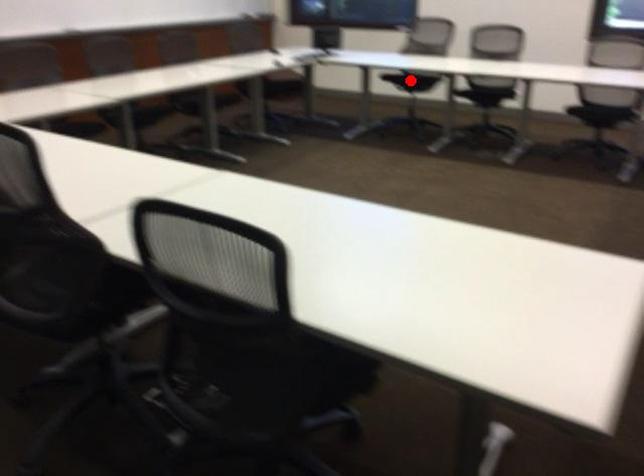
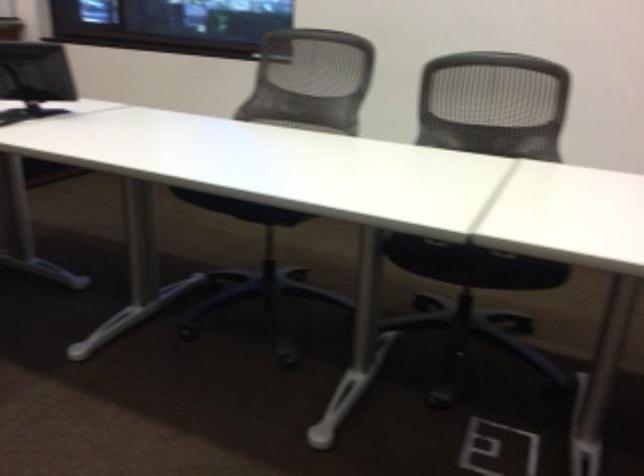
Question: I am providing you with two images of the same scene from different viewpoints. A red point is marked on the first image. At the location where the point appears in image 1, is it still visible in image 2?

Choices:
 (A) Yes
 (B) No

Answer: (B)